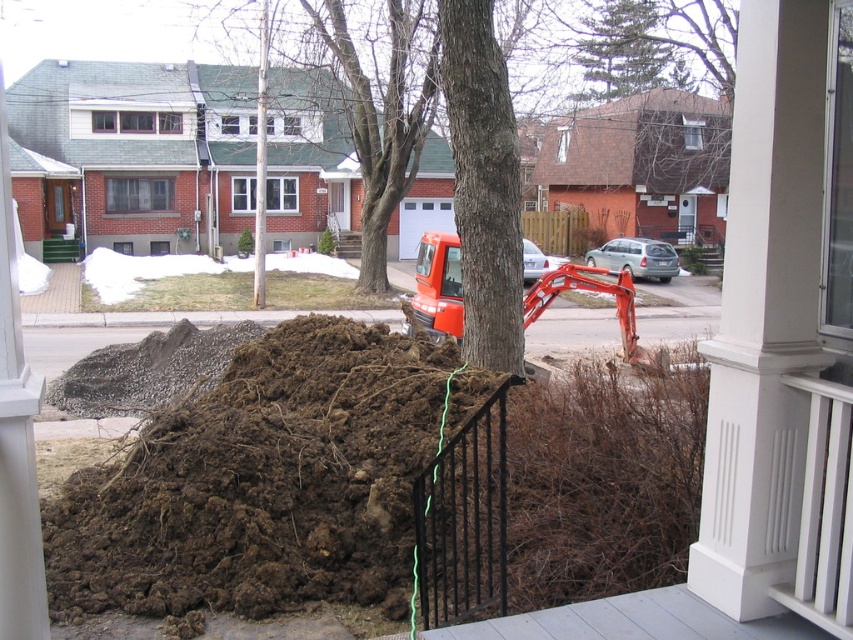
Which is behind, point (390, 4) or point (604, 97)?

The point (604, 97) is behind.

Is brown bark tree at center bigger than green textured pine tree at upper center?

Correct, brown bark tree at center is larger in size than green textured pine tree at upper center.

Does point (380, 234) lie in front of point (680, 84)?

Yes, point (380, 234) is closer to viewer.

Locate an element on the screen. The image size is (853, 640). brown bark tree at center is located at coordinates (370, 96).

Between point (360, 129) and point (546, 301), which one is positioned in front?

Point (546, 301)

From the picture: Which is above, brown bark tree at center or orange rubber excavator at center?

Positioned higher is brown bark tree at center.

Where is `brown bark tree at center`? The image size is (853, 640). brown bark tree at center is located at coordinates (370, 96).

Who is more forward, (344,388) or (370,205)?

Point (344,388) is in front.

Can you confirm if brown soil at lower left is bigger than brown bark tree at center?

No.

Which is behind, point (397, 604) or point (369, 113)?

Point (369, 113)

This screenshot has width=853, height=640. What are the coordinates of `brown soil at lower left` in the screenshot? It's located at (252, 483).